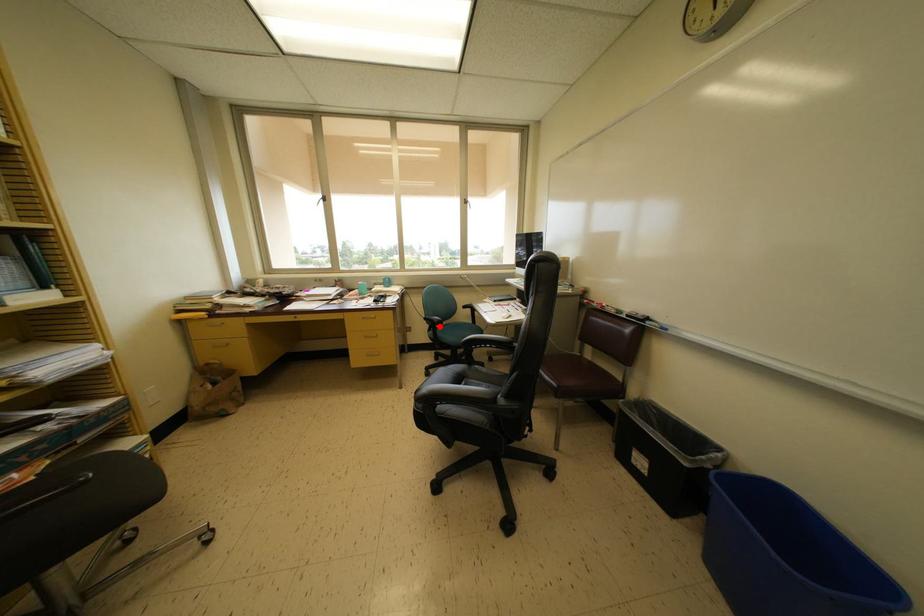
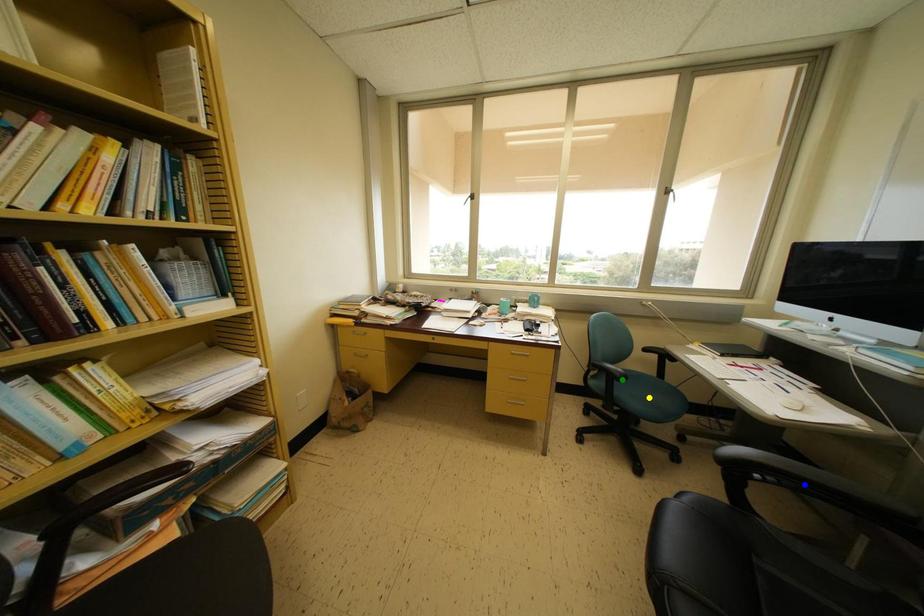
Question: I am providing you with two images of the same scene from different viewpoints. A red point is marked on the first image. You are given multiple points on the second image. Which point in image 2 represents the same 3d spot as the red point in image 1?

Choices:
 (A) blue point
 (B) green point
 (C) yellow point

Answer: (B)